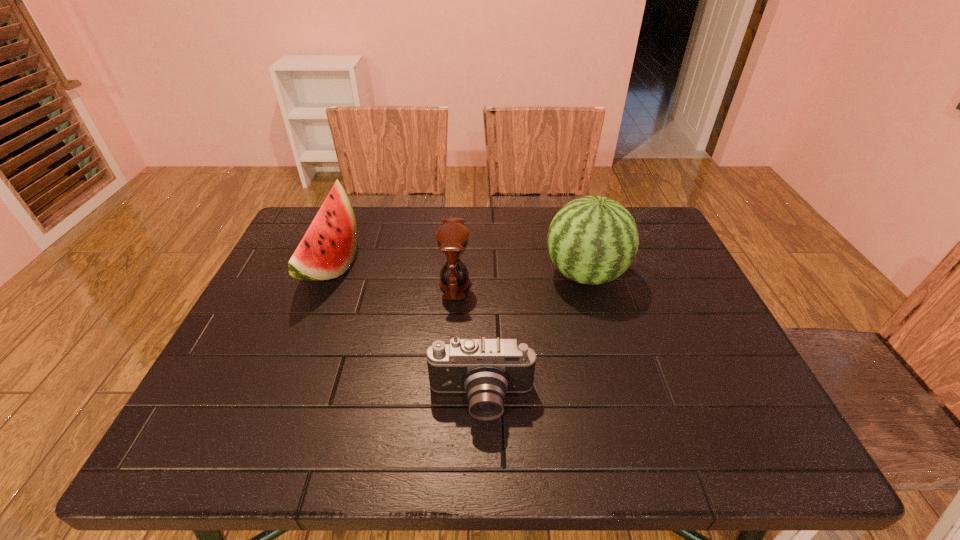
Find the location of `blank space that satisfies the following two spatial constraints: 1. on the outer rind of the shorter watermelon; 2. on the right side of the hourglass`. blank space that satisfies the following two spatial constraints: 1. on the outer rind of the shorter watermelon; 2. on the right side of the hourglass is located at coordinates (324, 284).

This screenshot has width=960, height=540. I want to click on free spot that satisfies the following two spatial constraints: 1. on the outer rind of the hourglass; 2. on the right side of the left watermelon, so click(324, 284).

Where is `vacant space that satisfies the following two spatial constraints: 1. on the outer rind of the taller watermelon; 2. on the right side of the left watermelon`? The image size is (960, 540). vacant space that satisfies the following two spatial constraints: 1. on the outer rind of the taller watermelon; 2. on the right side of the left watermelon is located at coordinates (327, 274).